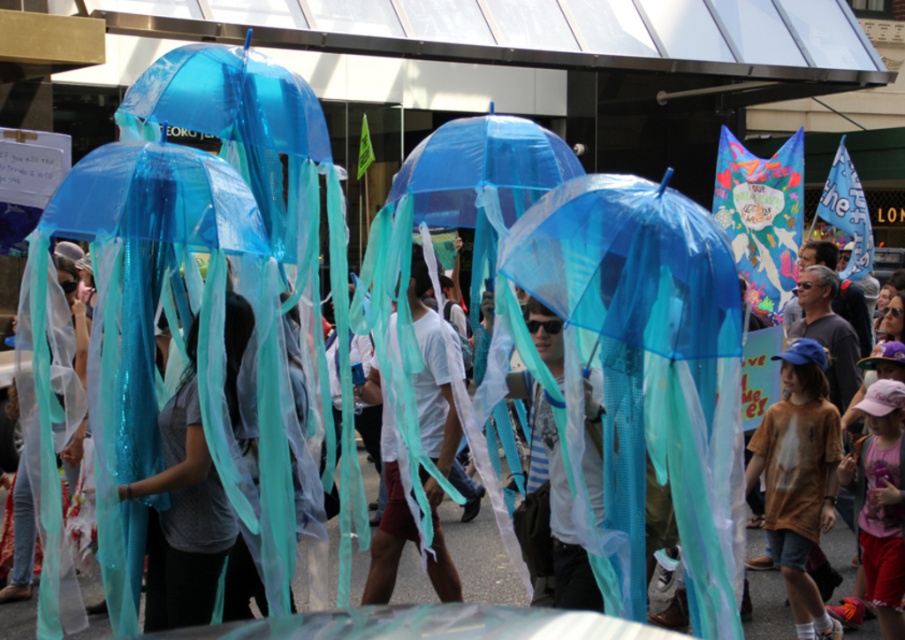
You are a photographer trying to capture both the matte gray shirt at center and the brown cotton shirt at center in a single frame. Since the shirts are different sizes, which one might you need to position closer to the camera to ensure they appear the same size in the photo?

The matte gray shirt at center is smaller than the brown cotton shirt at center. To make them appear the same size in the photo, you should position the smaller matte gray shirt at center closer to the camera and the larger brown cotton shirt at center farther away.

You are standing in the middle of the street and see two points in the scene. The first point is at coordinate point (894, 403) and the second is at point (837, 388). Which point is closer to you?

Point (894, 403) is closer to the viewer than point (837, 388).